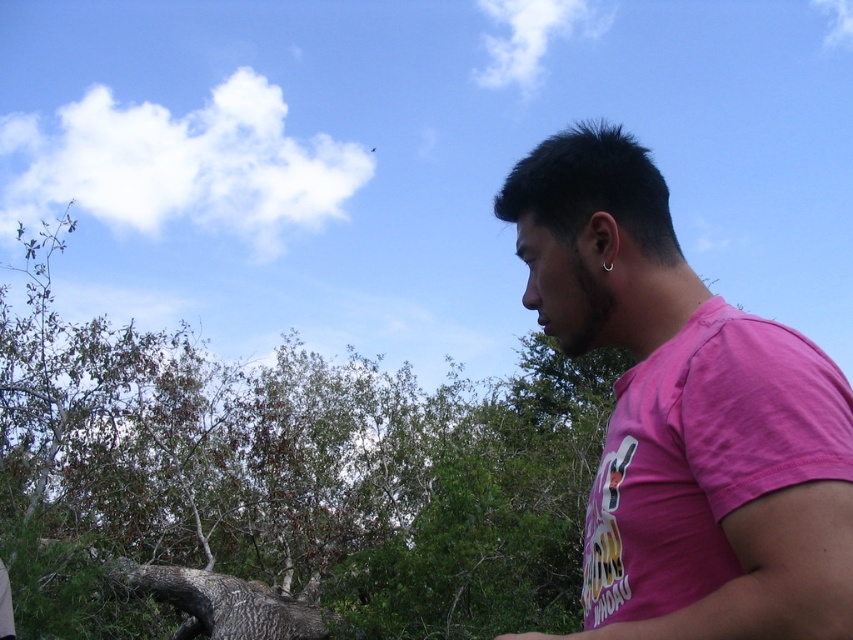
You are a photographer trying to capture a portrait of the person wearing the pink cotton shirt at right. However, you notice the green leafy tree at center might be blocking your view. Based on their sizes, do you think the tree is wider than the shirt?

The green leafy tree at center might be wider than pink cotton shirt at right, so there is a possibility that the tree could block the view of the pink cotton shirt at right in the portrait.

Where is the green leafy tree at center located in the image?

The green leafy tree at center is located at point [281,483] in the image.

You are taking a photo of the scene and want to focus on both the person and an object in the background. The person is at point [341,570] and the object is at point [834,618]. Which point should you focus on to ensure both are in focus?

You should focus on point [341,570] because it is closer to the camera than point [834,618]. By focusing on the closer point, the depth of field will likely include the farther object as well.